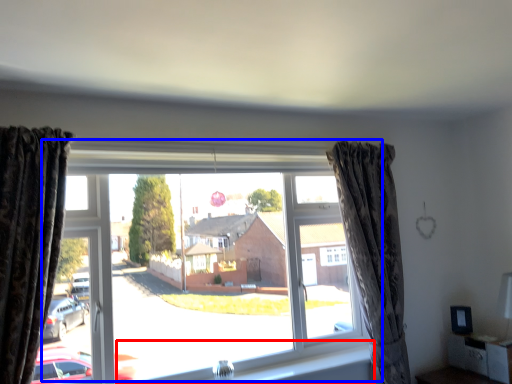
Question: Which object is further to the camera taking this photo, window sill (highlighted by a red box) or window (highlighted by a blue box)?

Choices:
 (A) window sill
 (B) window

Answer: (A)